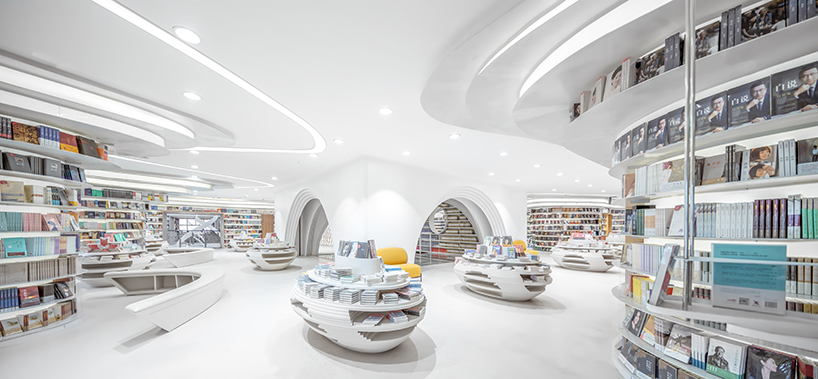
Where is `wall`? Image resolution: width=818 pixels, height=379 pixels. wall is located at coordinates (371, 227).